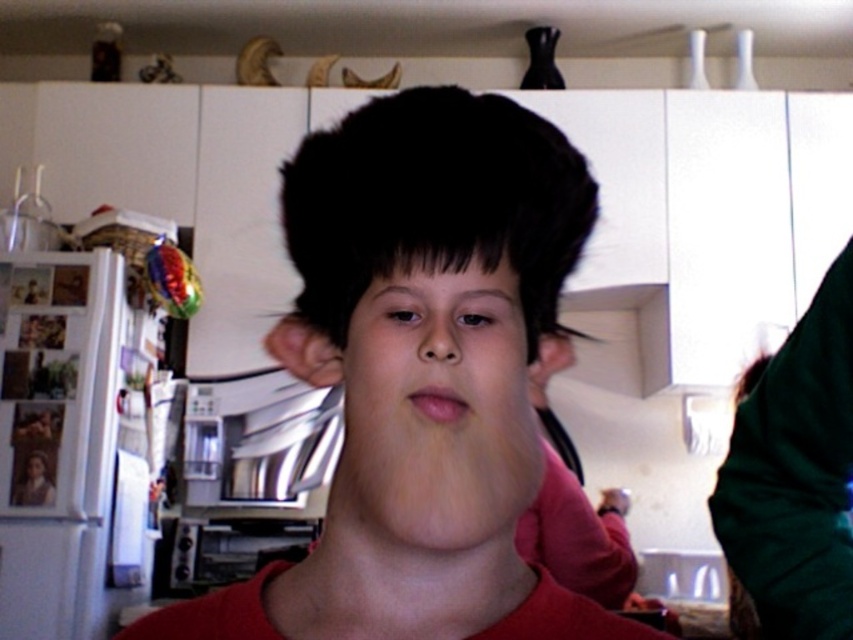
Question: Is the position of black matte hair at center less distant than that of smooth skin face at center?

Choices:
 (A) no
 (B) yes

Answer: (B)

Question: Is matte black wig at center smaller than black matte hair at center?

Choices:
 (A) no
 (B) yes

Answer: (A)

Question: Does matte black wig at center have a larger size compared to pink smooth lips at center?

Choices:
 (A) no
 (B) yes

Answer: (B)

Question: Which point is closer to the camera taking this photo?

Choices:
 (A) (485, 496)
 (B) (445, 188)

Answer: (B)

Question: Which point is farther to the camera?

Choices:
 (A) (186, 609)
 (B) (492, 170)

Answer: (A)

Question: Based on their relative distances, which object is farther from the matte skin nose at center?

Choices:
 (A) smooth skin face at center
 (B) pink smooth lips at center

Answer: (A)